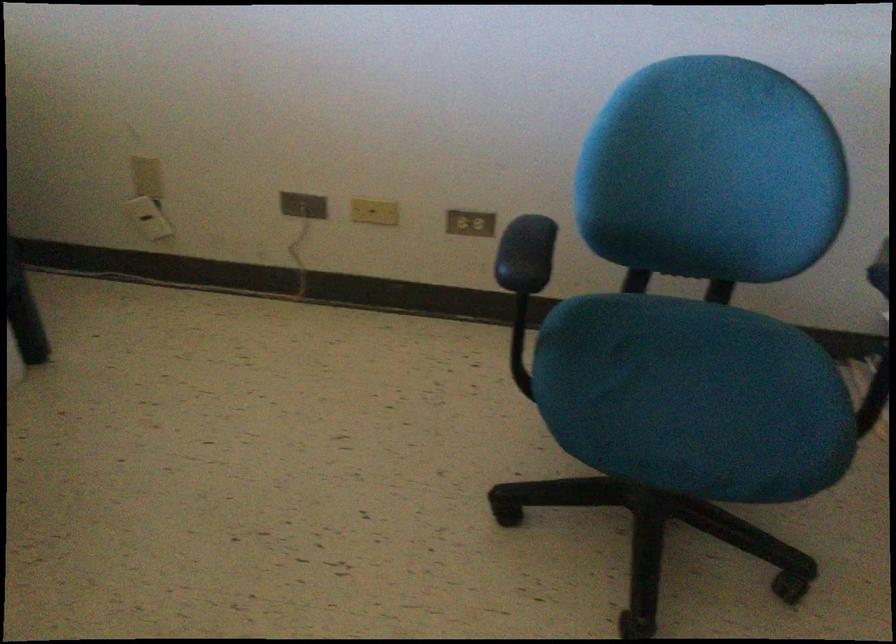
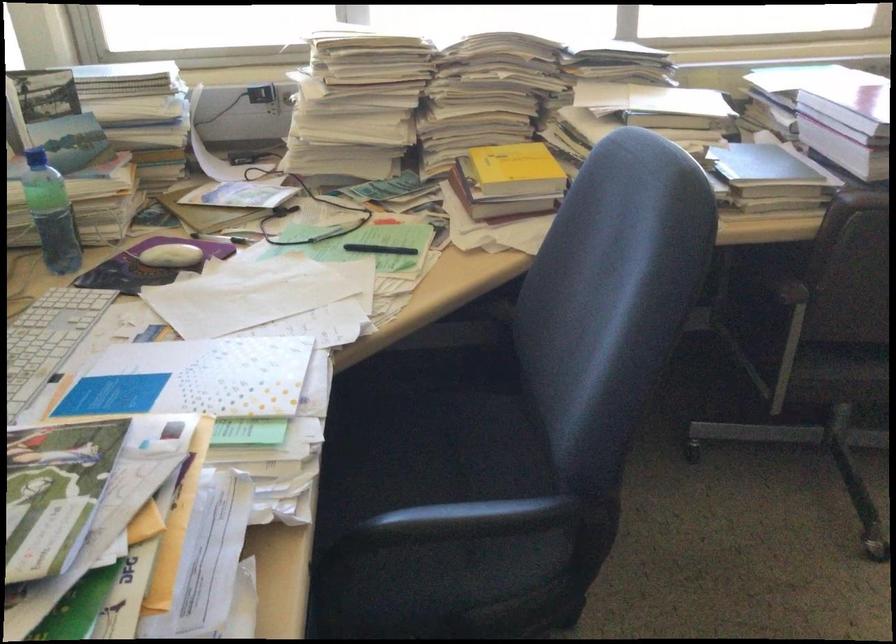
Question: The images are taken continuously from a first-person perspective. In which direction is your viewpoint rotating?

Choices:
 (A) Left
 (B) Right
 (C) Up
 (D) Down

Answer: (A)